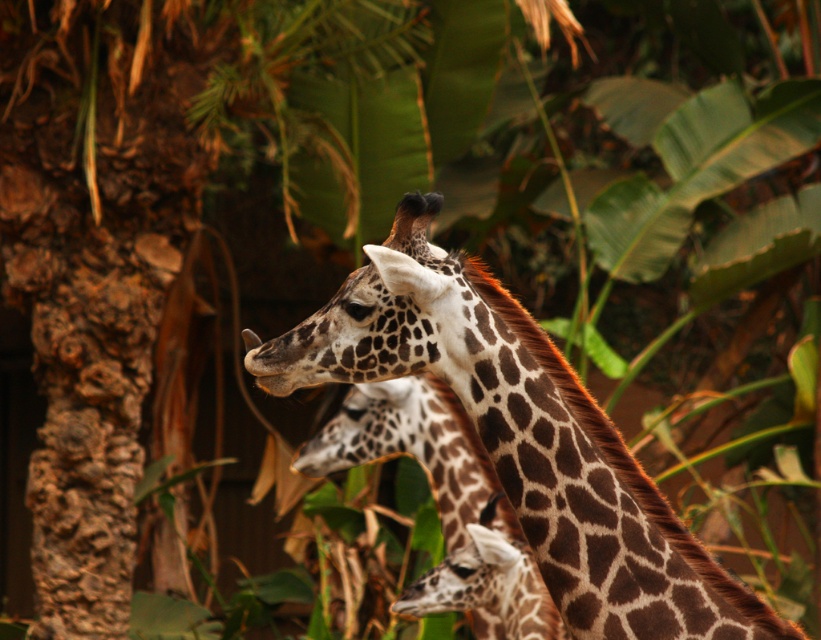
Does spotted fur giraffe at center appear over brown spotted giraffe at center?

Yes, spotted fur giraffe at center is above brown spotted giraffe at center.

Can you confirm if spotted fur giraffe at center is positioned to the left of brown spotted giraffe at center?

No, spotted fur giraffe at center is not to the left of brown spotted giraffe at center.

Is point (673, 554) farther from viewer compared to point (508, 632)?

No, (673, 554) is closer to viewer.

You are a GUI agent. You are given a task and a screenshot of the screen. Output one action in this format:
    pyautogui.click(x=<x>, y=<y>)
    Task: Click on the spotted fur giraffe at center
    The image size is (821, 640).
    Given the screenshot: What is the action you would take?
    pyautogui.click(x=521, y=436)